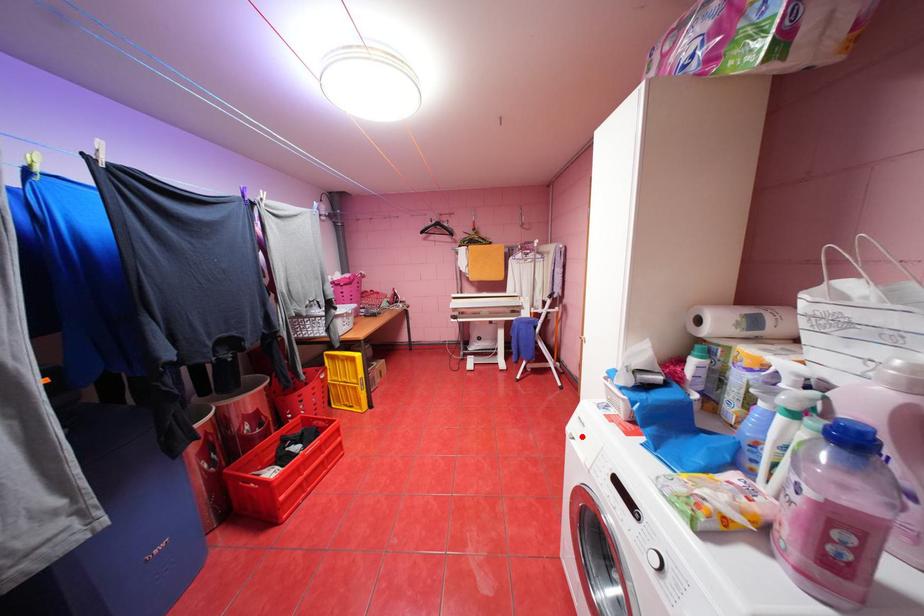
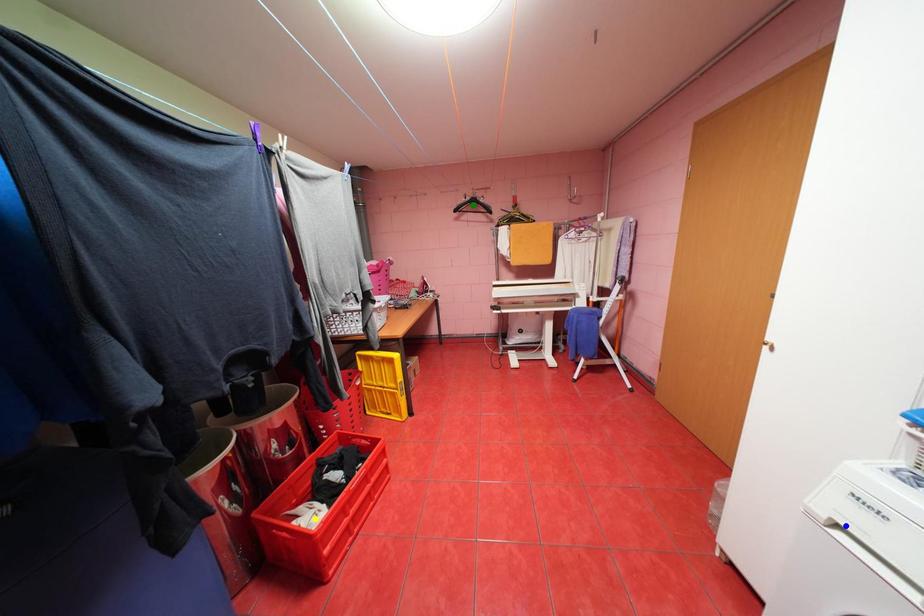
Question: I am providing you with two images of the same scene from different viewpoints. A red point is marked on the first image. You are given multiple points on the second image. Can you choose the point in image 2 that corresponds to the point in image 1?

Choices:
 (A) green point
 (B) yellow point
 (C) blue point

Answer: (C)